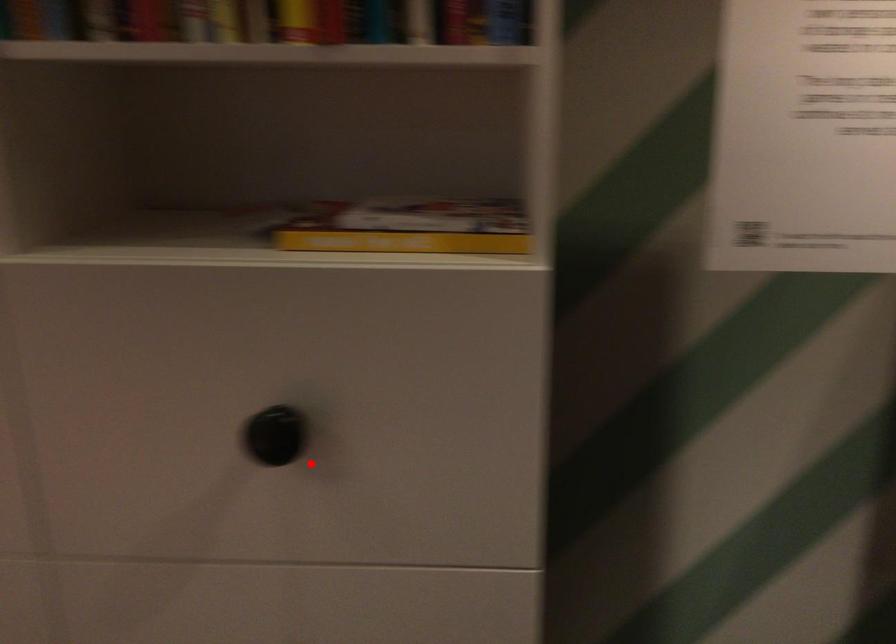
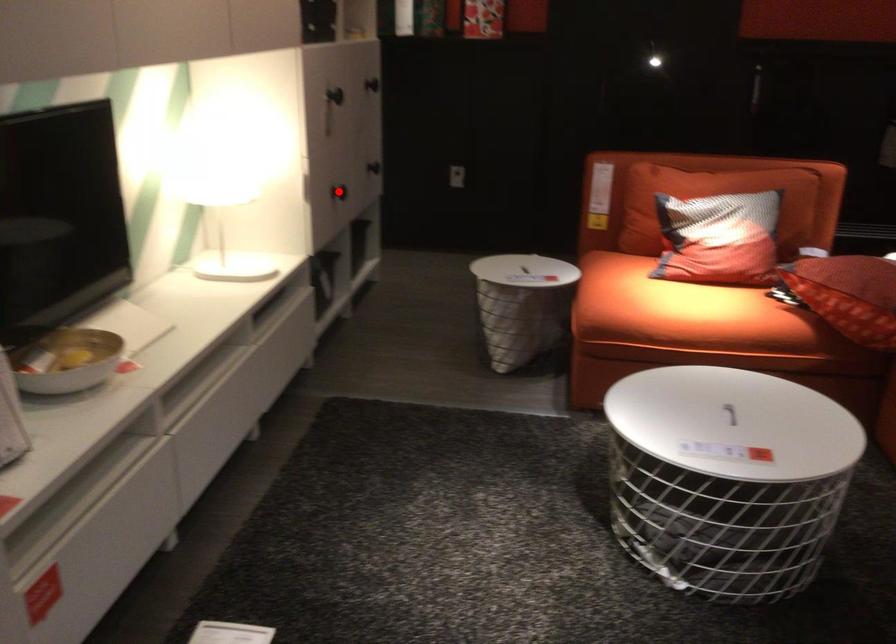
I am providing you with two images of the same scene from different viewpoints. A red point is marked on the first image and another point is marked on the second image. Do the highlighted points in image1 and image2 indicate the same real-world spot?

No